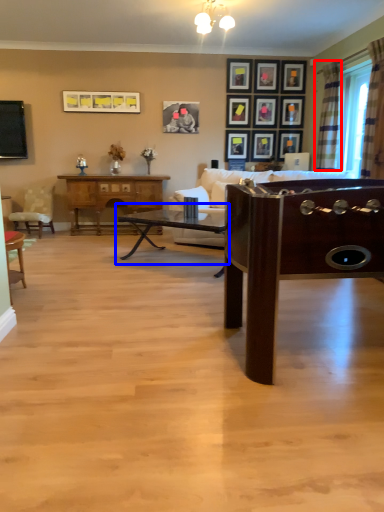
Question: Among these objects, which one is farthest to the camera, curtain (highlighted by a red box) or coffee table (highlighted by a blue box)?

Choices:
 (A) curtain
 (B) coffee table

Answer: (A)